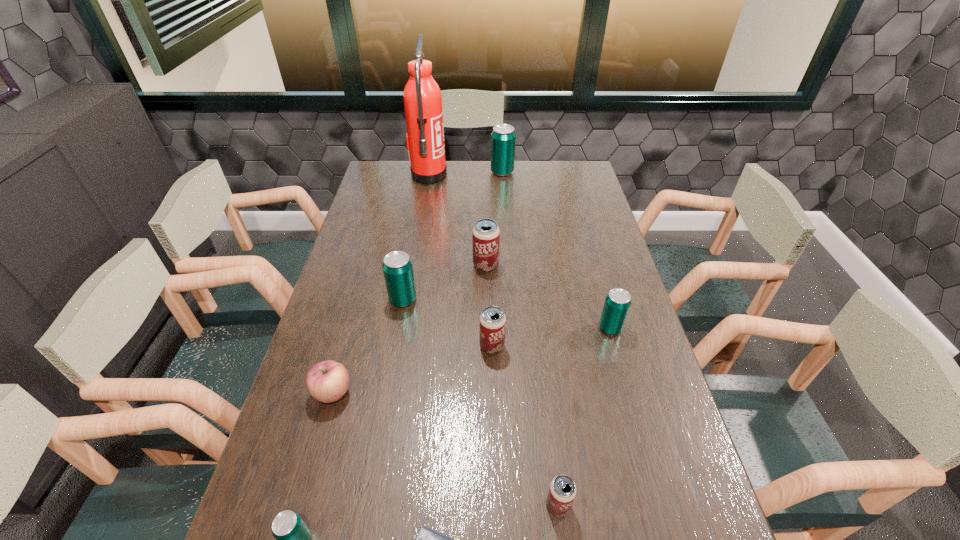
Identify the location of the tallest object. (422, 98).

At what (x,y) coordinates should I click in order to perform the action: click on the tallest beer can. Please return your answer as a coordinate pair (x, y). Image resolution: width=960 pixels, height=540 pixels. Looking at the image, I should click on (503, 138).

Where is `the farthest teal beer can`? Image resolution: width=960 pixels, height=540 pixels. the farthest teal beer can is located at coordinates (503, 138).

Find the location of a particular element. The image size is (960, 540). the second teal beer can from left to right is located at coordinates (397, 267).

Locate an element on the screen. The image size is (960, 540). the third nearest teal beer can is located at coordinates (397, 267).

The width and height of the screenshot is (960, 540). In order to click on the sixth nearest beer can in this screenshot , I will do `click(485, 235)`.

Identify the location of the farthest red beer can. pos(485,235).

The height and width of the screenshot is (540, 960). I want to click on the second nearest red beer can, so click(492, 320).

Locate an element on the screen. This screenshot has width=960, height=540. the rightmost object is located at coordinates (617, 303).

At what (x,y) coordinates should I click in order to perform the action: click on the second nearest teal beer can. Please return your answer as a coordinate pair (x, y). The image size is (960, 540). Looking at the image, I should click on (617, 303).